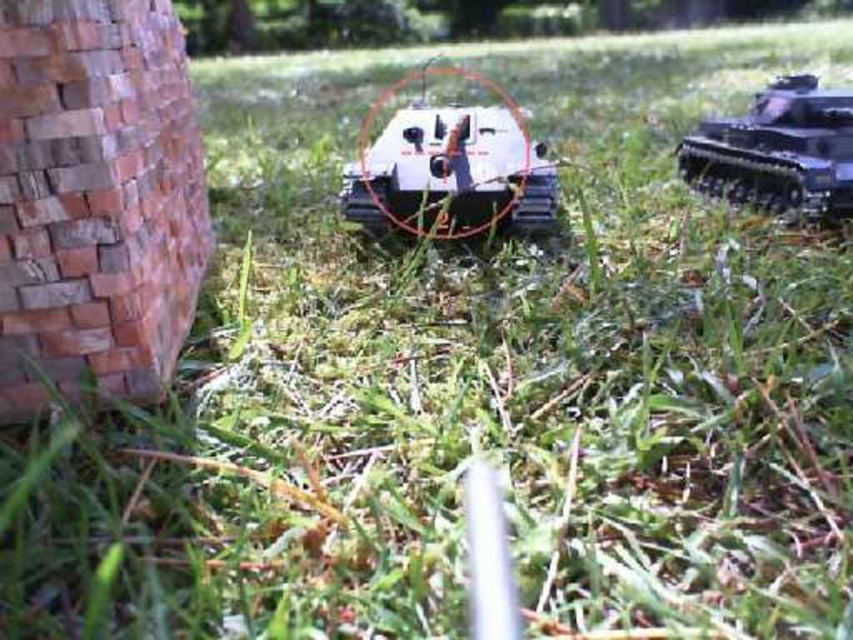
Question: Can you confirm if white plastic tank at center is smaller than shiny black tank at upper right?

Choices:
 (A) yes
 (B) no

Answer: (A)

Question: Which object appears farthest from the camera in this image?

Choices:
 (A) shiny black tank at upper right
 (B) white plastic tank at center

Answer: (A)

Question: Which object appears farthest from the camera in this image?

Choices:
 (A) white plastic tank at center
 (B) shiny black tank at upper right

Answer: (B)

Question: Which object is farther from the camera taking this photo?

Choices:
 (A) shiny black tank at upper right
 (B) white plastic tank at center

Answer: (A)

Question: Is white plastic tank at center wider than shiny black tank at upper right?

Choices:
 (A) yes
 (B) no

Answer: (A)

Question: Can you confirm if white plastic tank at center is positioned to the left of shiny black tank at upper right?

Choices:
 (A) no
 (B) yes

Answer: (B)